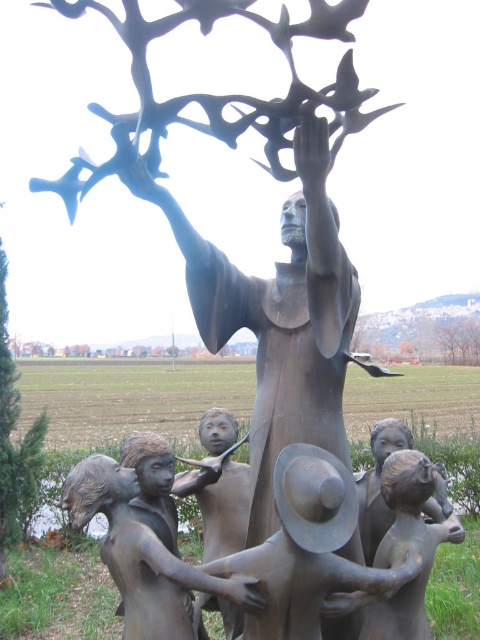
The height and width of the screenshot is (640, 480). What do you see at coordinates (420, 333) in the screenshot? I see `green matte tree at upper center` at bounding box center [420, 333].

Between point (357, 324) and point (3, 369), which one is positioned in front?

Point (3, 369) is more forward.

Where is `green matte tree at upper center`? This screenshot has width=480, height=640. green matte tree at upper center is located at coordinates (420, 333).

Is brushed metal hat at lower center smaller than green matte tree at upper center?

Yes.

Can you confirm if brushed metal hat at lower center is bigger than green matte tree at upper center?

No.

Locate an element on the screen. This screenshot has width=480, height=640. brushed metal hat at lower center is located at coordinates (307, 547).

Is brushed metal hat at lower center to the right of brown wood tree at upper center from the viewer's perspective?

No, brushed metal hat at lower center is not to the right of brown wood tree at upper center.

Who is shorter, brushed metal hat at lower center or brown wood tree at upper center?

Standing shorter between the two is brushed metal hat at lower center.

Image resolution: width=480 pixels, height=640 pixels. What are the coordinates of `brushed metal hat at lower center` in the screenshot? It's located at (307, 547).

I want to click on brushed metal hat at lower center, so click(x=307, y=547).